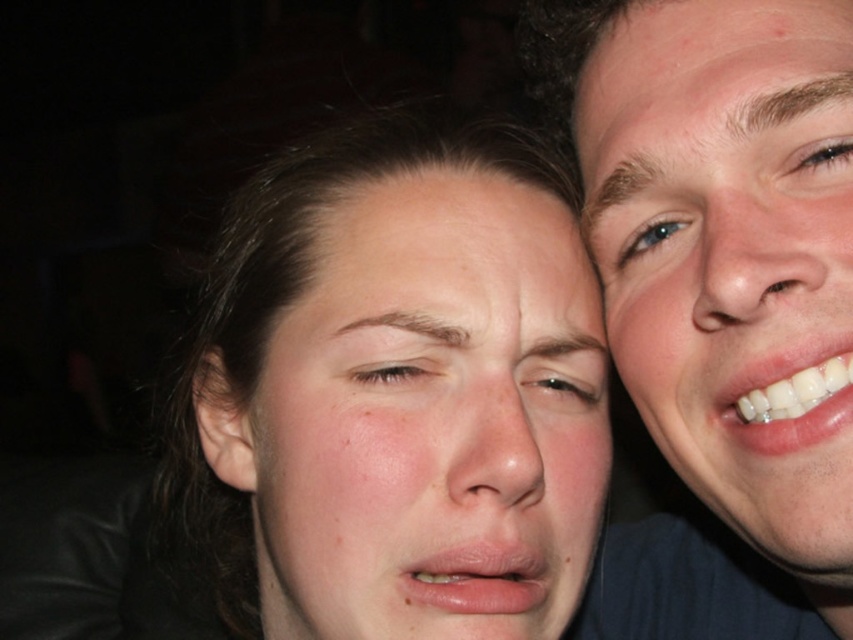
Between light brown skin at center and blue glossy eye at upper right, which one appears on the left side from the viewer's perspective?

light brown skin at center

Does light brown skin at center have a greater height compared to blue glossy eye at upper right?

In fact, light brown skin at center may be shorter than blue glossy eye at upper right.

Image resolution: width=853 pixels, height=640 pixels. What are the coordinates of `light brown skin at center` in the screenshot? It's located at (396, 371).

Is dry skin at upper right closer to camera compared to brown glossy eye at upper right?

Yes, it is.

Who is lower down, dry skin at upper right or brown glossy eye at upper right?

brown glossy eye at upper right

Who is more forward, (605, 70) or (833, 166)?

Point (833, 166) is more forward.

This screenshot has height=640, width=853. Identify the location of dry skin at upper right. (711, 77).

Is point (366, 248) farther from camera compared to point (643, 243)?

No, it is in front of (643, 243).

The width and height of the screenshot is (853, 640). Describe the element at coordinates (428, 419) in the screenshot. I see `smooth skin face at center` at that location.

Locate an element on the screen. smooth skin face at center is located at coordinates (428, 419).